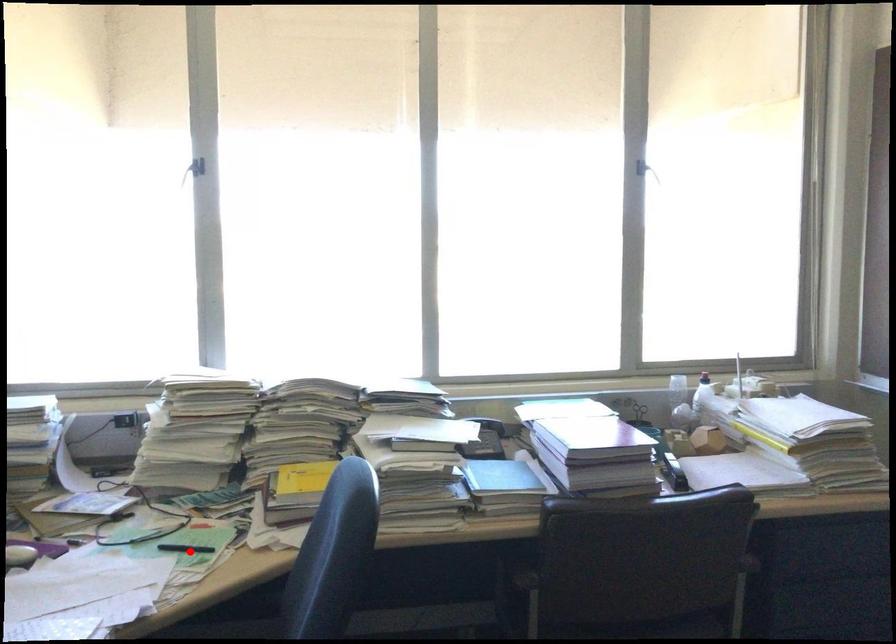
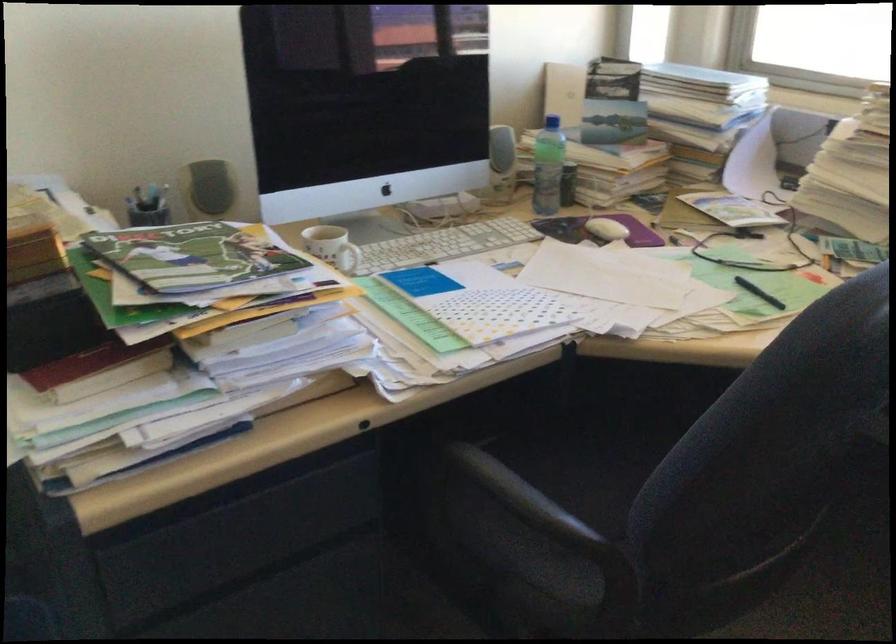
Question: I am providing you with two images of the same scene from different viewpoints. In image1, a red point is highlighted. Considering the same 3D point in image2, which of the following is correct?

Choices:
 (A) It is closer
 (B) It is farther

Answer: (A)